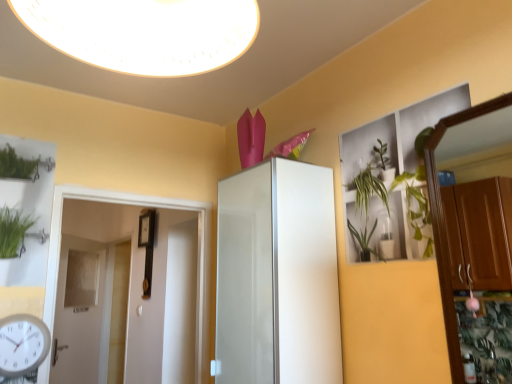
Question: Considering their positions, is wooden dresser at right located in front of or behind white glossy door at left, marked as the 1th door in a right-to-left arrangement?

Choices:
 (A) front
 (B) behind

Answer: (A)

Question: From their relative heights in the image, would you say wooden dresser at right is taller or shorter than white glossy door at left, marked as the 1th door in a right-to-left arrangement?

Choices:
 (A) short
 (B) tall

Answer: (A)

Question: Estimate the real-world distances between objects in this image. Which object is closer to the white glossy light fixture at upper center?

Choices:
 (A) white glossy door at left, positioned as the 1th door in front-to-back order
 (B) white glossy door at left, positioned as the 2th door in front-to-back order
 (C) white plastic clock at lower left
 (D) white glossy cabinet at center
 (E) wooden dresser at right

Answer: (D)

Question: Estimate the real-world distances between objects in this image. Which object is farther from the white glossy light fixture at upper center?

Choices:
 (A) white plastic clock at lower left
 (B) white glossy cabinet at center
 (C) wooden dresser at right
 (D) white glossy door at left, positioned as the 2th door in front-to-back order
 (E) white glossy door at left, positioned as the 1th door in front-to-back order

Answer: (D)